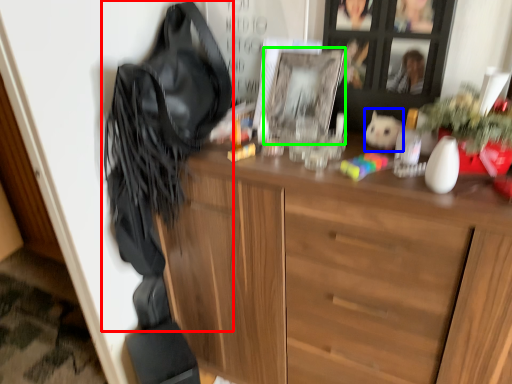
Question: Which object is positioned closest to shoulder bag (highlighted by a red box)? Select from animal (highlighted by a blue box) and picture frame (highlighted by a green box).

Choices:
 (A) animal
 (B) picture frame

Answer: (B)